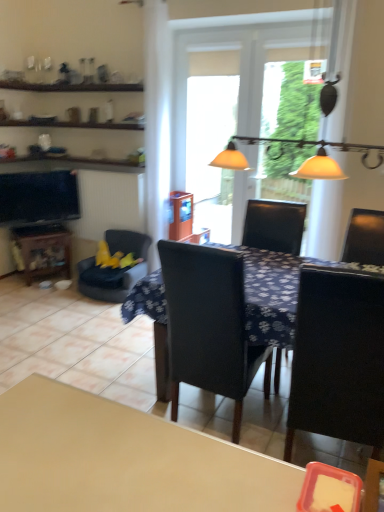
Question: Is translucent plastic screen door at center at the right side of transparent glass window at center?

Choices:
 (A) yes
 (B) no

Answer: (B)

Question: Is translucent plastic screen door at center further to the viewer compared to transparent glass window at center?

Choices:
 (A) yes
 (B) no

Answer: (A)

Question: Is translucent plastic screen door at center bigger than transparent glass window at center?

Choices:
 (A) no
 (B) yes

Answer: (B)

Question: Would you say transparent glass window at center is part of translucent plastic screen door at center's contents?

Choices:
 (A) no
 (B) yes

Answer: (B)

Question: Can you confirm if translucent plastic screen door at center is thinner than transparent glass window at center?

Choices:
 (A) no
 (B) yes

Answer: (A)

Question: Is translucent plastic screen door at center closer to camera compared to transparent glass window at center?

Choices:
 (A) no
 (B) yes

Answer: (A)

Question: Is matte black tv at left closer to the viewer compared to transparent glass window at center?

Choices:
 (A) no
 (B) yes

Answer: (A)

Question: Can transparent glass window at center be found inside matte black tv at left?

Choices:
 (A) no
 (B) yes

Answer: (A)

Question: Is matte black tv at left positioned with its back to transparent glass window at center?

Choices:
 (A) yes
 (B) no

Answer: (B)

Question: Is matte black tv at left bigger than transparent glass window at center?

Choices:
 (A) yes
 (B) no

Answer: (B)

Question: Is matte black tv at left at the left side of transparent glass window at center?

Choices:
 (A) no
 (B) yes

Answer: (B)

Question: From a real-world perspective, is matte black tv at left physically above transparent glass window at center?

Choices:
 (A) no
 (B) yes

Answer: (A)

Question: Is the depth of velvet yellow chair at left, which ranks as the first chair in left-to-right order, greater than that of dark blue fabric table at center?

Choices:
 (A) yes
 (B) no

Answer: (A)